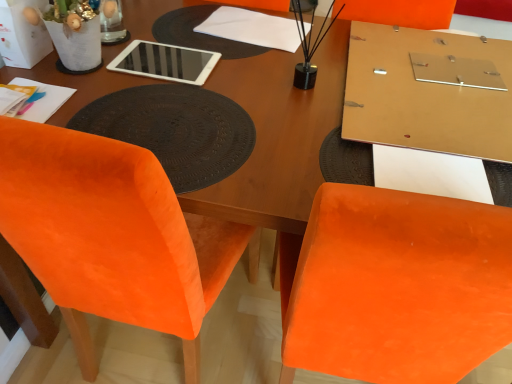
Identify the location of vacant point to the right of brown textured placemat at center. (344, 129).